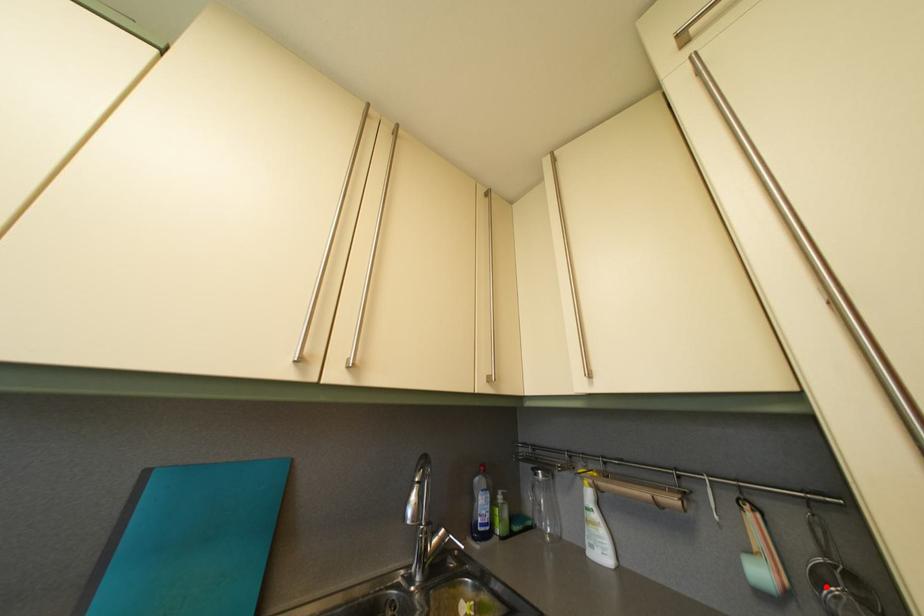
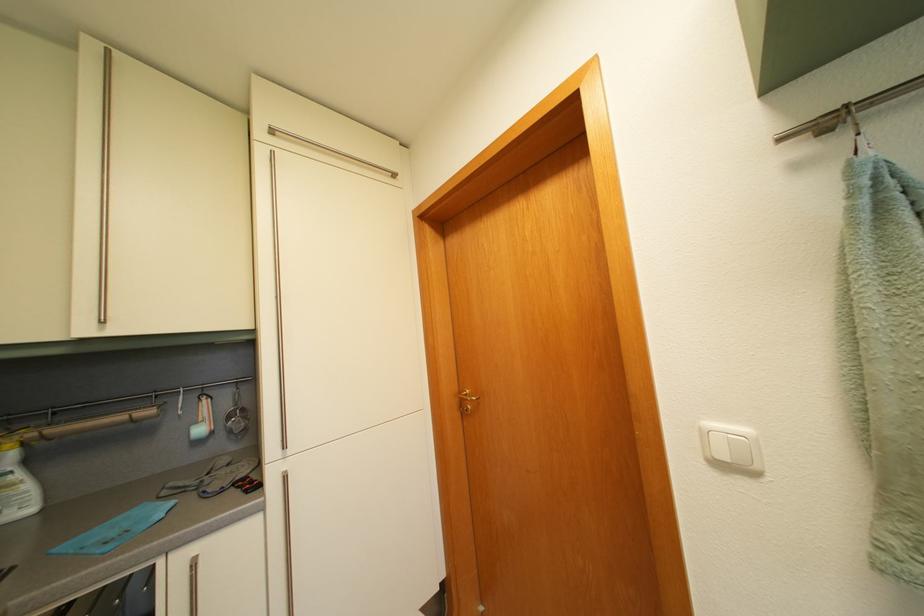
Question: I am providing you with two images of the same scene from different viewpoints. A red point is marked on the first image. Can you still see the location of the red point in image 2?

Choices:
 (A) Yes
 (B) No

Answer: (A)